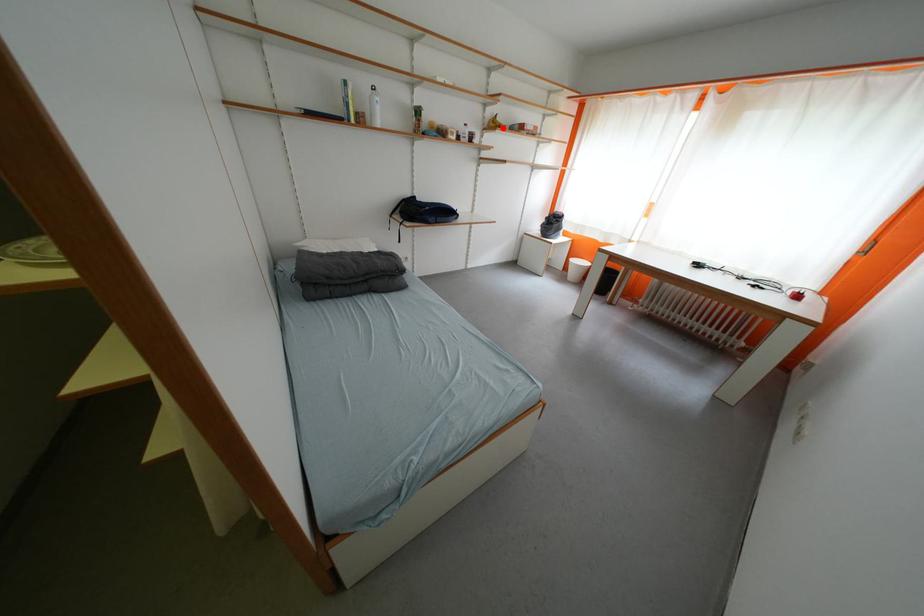
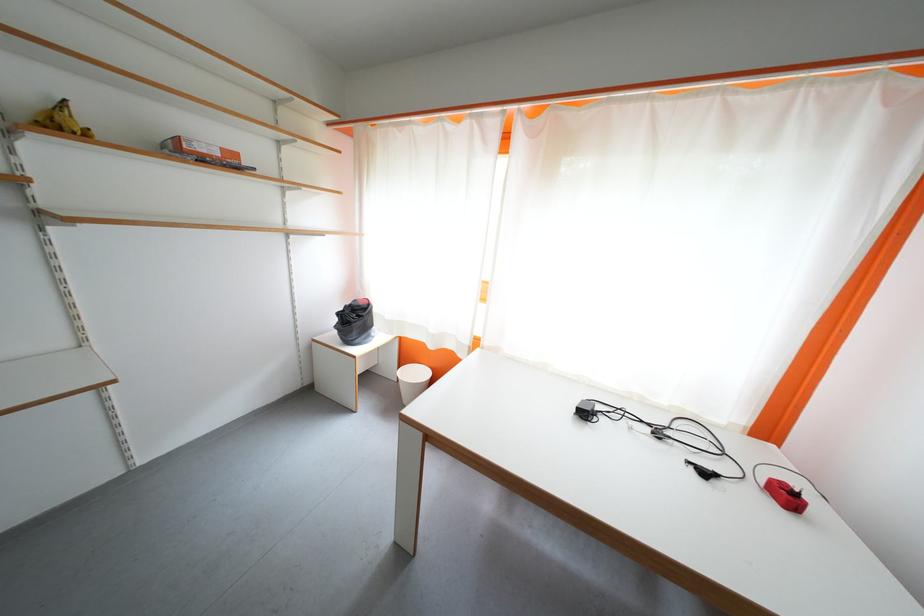
The point at the highlighted location is marked in the first image. Where is the corresponding point in the second image?

(68, 129)